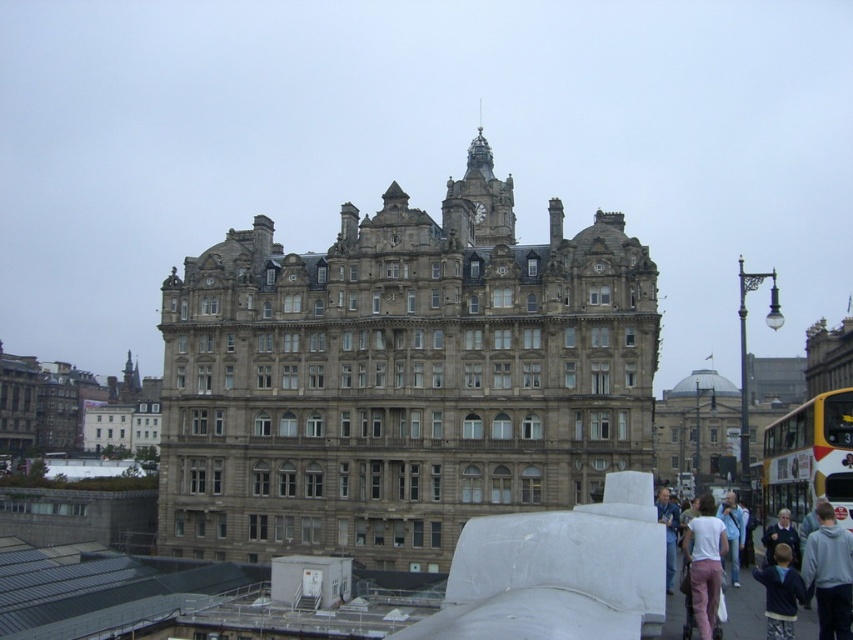
You are standing in front of the grand Victorian building and notice two dark blue garments at the lower right corner. Which one is closer to you, the dark blue hoodie at lower right or the dark blue jacket at lower right?

The dark blue hoodie at lower right is closer to you because it is in front of the dark blue jacket at lower right.

You are standing at the base of the grand Victorian building and want to take a photo of both the gray hoodie at lower right and the matte white shirt at lower right. Since you need to ensure both are in focus, will their distance apart affect the camera settings? Explain.

The gray hoodie at lower right is 7.39 meters away from the matte white shirt at lower right, so their distance apart may require adjusting the camera settings to ensure both are in focus. The greater the distance between subjects, the more critical the depth of field becomes.